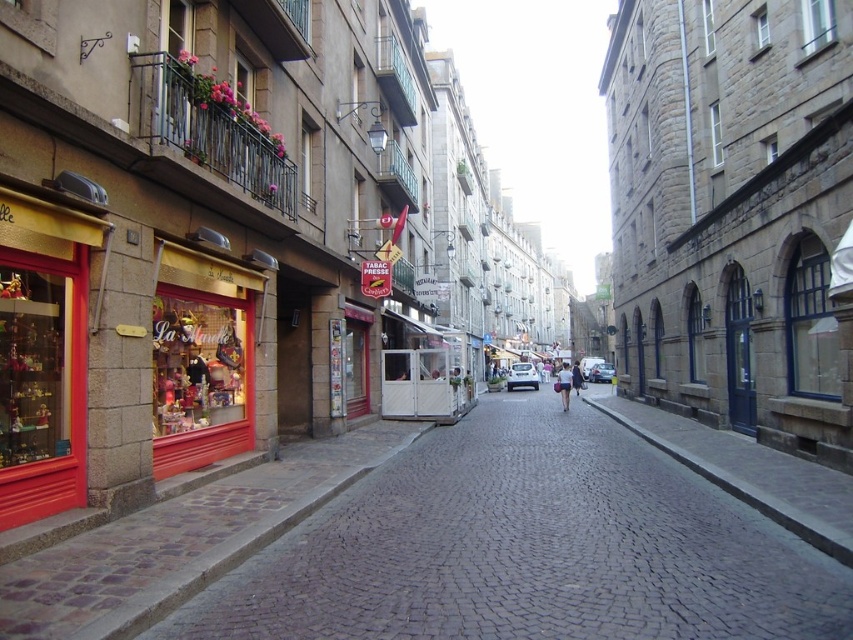
You are a delivery person with a cart that is 3 meters wide. You need to navigate through the street between the cobblestone pavement at center and the dark gray stone wall at center. Can your cart fit through the space between them?

The distance between the cobblestone pavement at center and the dark gray stone wall at center is 2.64 meters. Since your cart is 3 meters wide, it cannot fit through the space between them.

You are standing on the cobblestone pavement at center. A friend is holding a map and asks you to describe your exact location in the scene. How would you describe it using the coordinates provided?

The cobblestone pavement at center is located at coordinates point (527, 548).

You are a tourist standing on the cobblestone pavement at center and want to take a photo of the dark gray stone wall at center. Which object in the scene takes up more area in your camera view?

The dark gray stone wall at center occupies more space than the cobblestone pavement at center in the camera view because the cobblestone pavement at center occupies less space than dark gray stone wall at center.